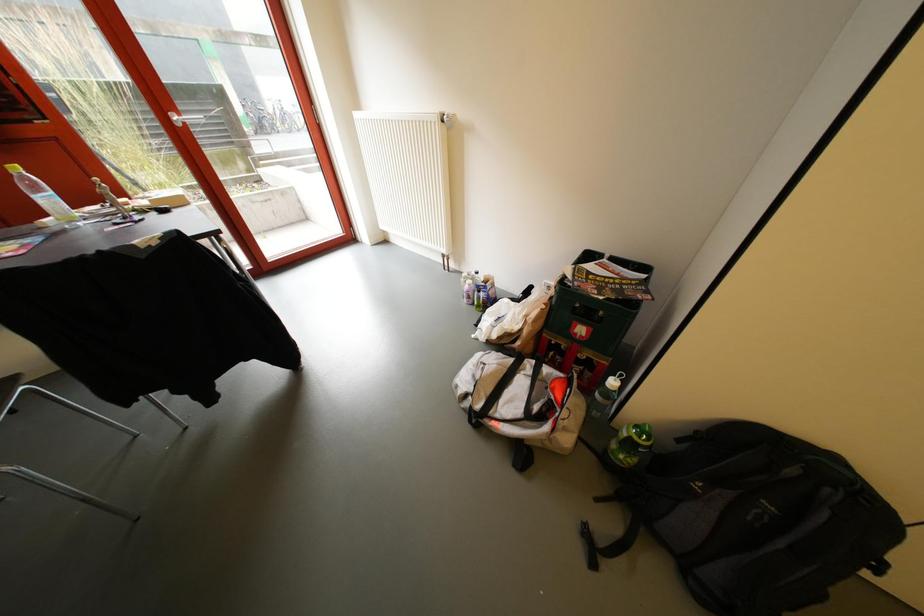
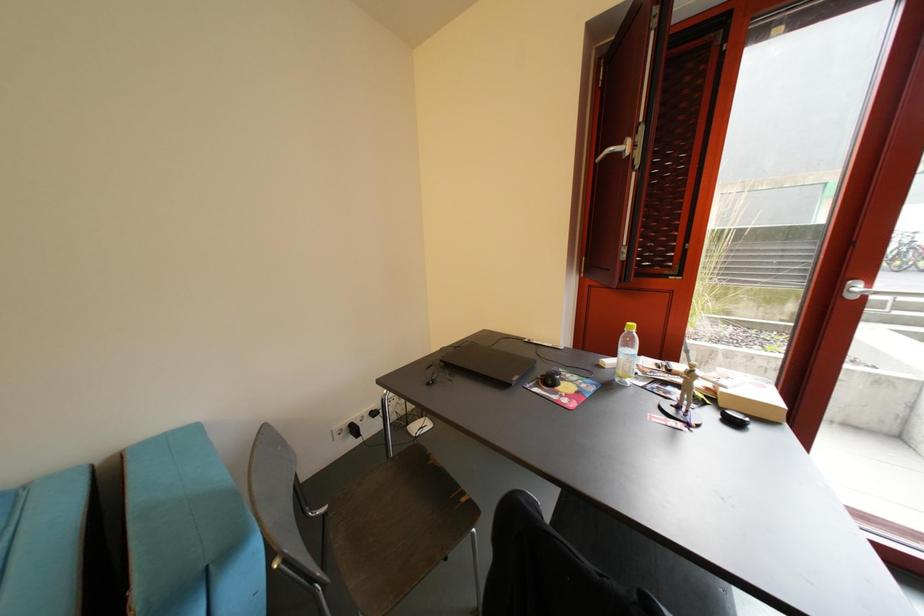
Question: The images are taken continuously from a first-person perspective. In which direction is your viewpoint rotating?

Choices:
 (A) Left
 (B) Right
 (C) Up
 (D) Down

Answer: (A)